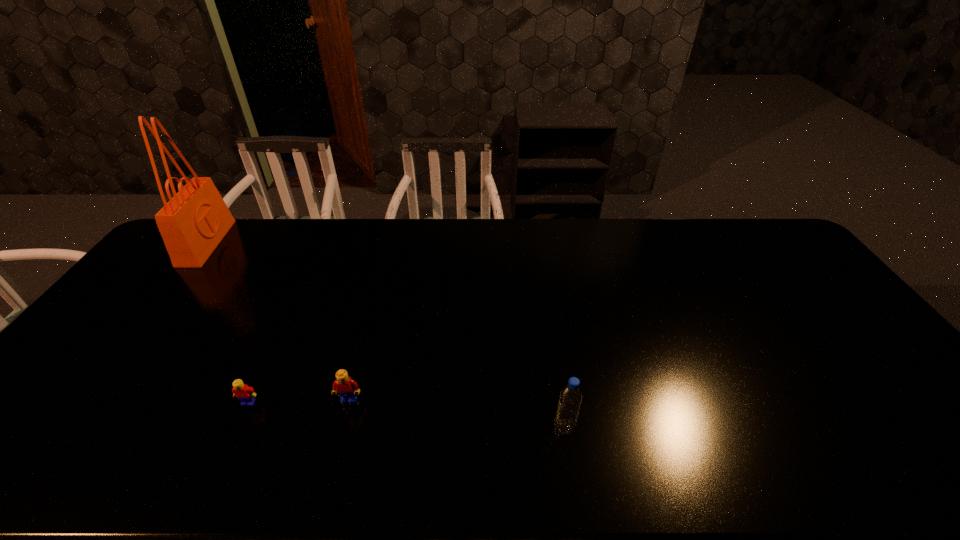
Find the location of a particular element. free location located on the front-facing side of the third tallest object is located at coordinates (338, 446).

At what (x,y) coordinates should I click in order to perform the action: click on vacant space located on the front-facing side of the shortest object. Please return your answer as a coordinate pair (x, y). Looking at the image, I should click on (229, 444).

Identify the location of object situated at the far edge. The width and height of the screenshot is (960, 540). (192, 224).

What are the coordinates of `object that is at the left edge` in the screenshot? It's located at (192, 224).

Image resolution: width=960 pixels, height=540 pixels. I want to click on object that is at the far left corner, so click(x=192, y=224).

The image size is (960, 540). In order to click on vacant space at the far edge of the desktop in this screenshot , I will do `click(549, 238)`.

The image size is (960, 540). Identify the location of vacant space at the left edge of the desktop. (157, 284).

The width and height of the screenshot is (960, 540). In the image, there is a desktop. In order to click on vacant space at the right edge in this screenshot , I will do `click(786, 280)`.

Where is `empty space between the farthest object and the second object from right to left`? The height and width of the screenshot is (540, 960). empty space between the farthest object and the second object from right to left is located at coordinates (278, 321).

This screenshot has height=540, width=960. What are the coordinates of `free space between the tote bag and the second tallest object` in the screenshot? It's located at (385, 335).